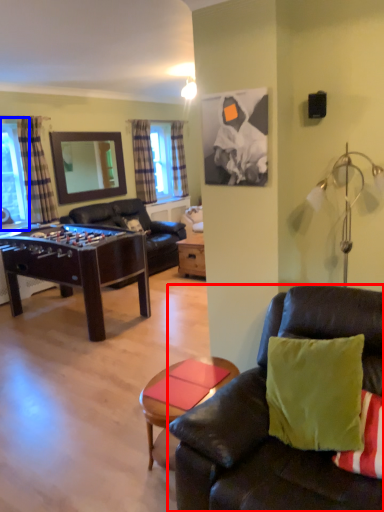
Question: Which object appears closest to the camera in this image, studio couch (highlighted by a red box) or window screen (highlighted by a blue box)?

Choices:
 (A) studio couch
 (B) window screen

Answer: (A)